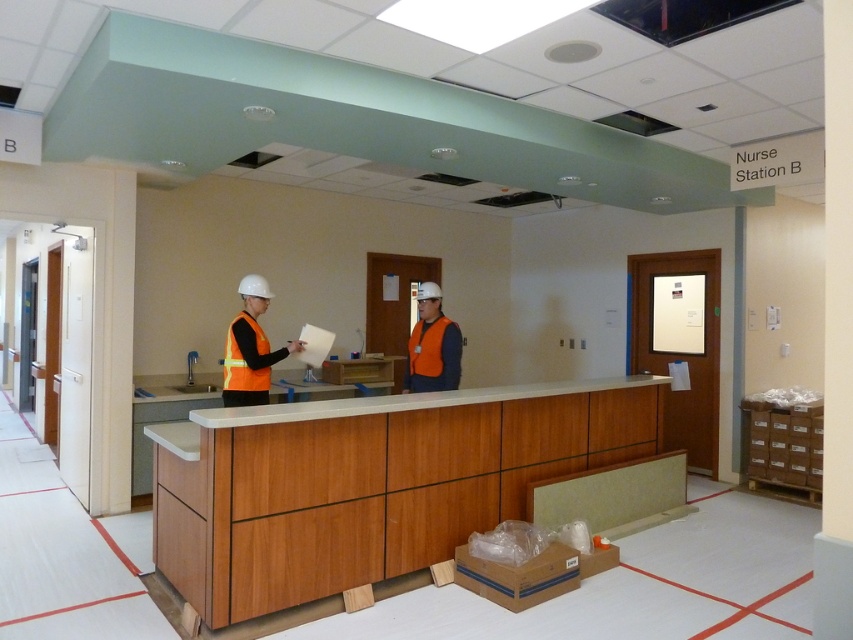
Does orange reflective vest at center appear over orange reflective safety vest at center?

Yes.

Which of these two, orange reflective vest at center or orange reflective safety vest at center, stands shorter?

Standing shorter between the two is orange reflective safety vest at center.

At what (x,y) coordinates should I click in order to perform the action: click on orange reflective vest at center. Please return your answer as a coordinate pair (x, y). The height and width of the screenshot is (640, 853). Looking at the image, I should click on coord(250,348).

Which is above, wooden cabinet at center or orange reflective vest at center?

orange reflective vest at center is above.

Between wooden cabinet at center and orange reflective vest at center, which one has more height?

Standing taller between the two is wooden cabinet at center.

Image resolution: width=853 pixels, height=640 pixels. What are the coordinates of `wooden cabinet at center` in the screenshot? It's located at (368, 483).

Between orange reflective vest at center and high-visibility orange safety vest at center, which one is positioned higher?

orange reflective vest at center is above.

Who is more distant from viewer, (244, 401) or (244, 388)?

The point (244, 388) is more distant.

Find the location of a particular element. The width and height of the screenshot is (853, 640). orange reflective vest at center is located at coordinates (250, 348).